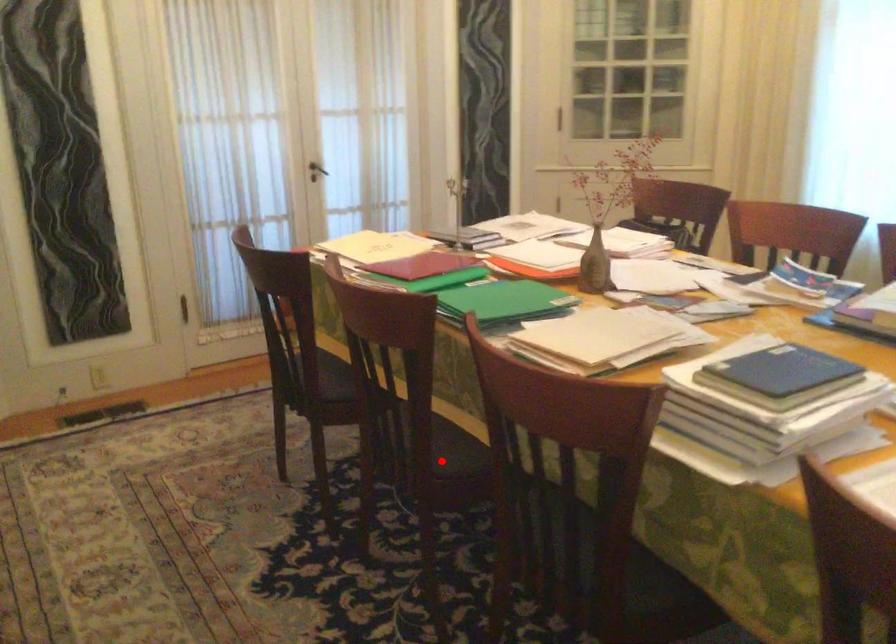
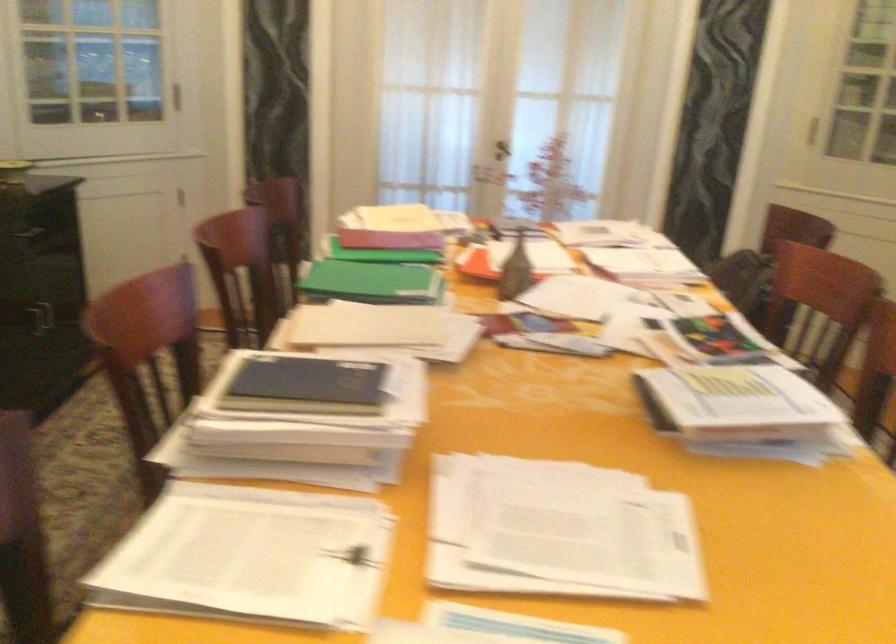
Question: I am providing you with two images of the same scene from different viewpoints. A red point is marked on the first image. Can you still see the location of the red point in image 2?

Choices:
 (A) Yes
 (B) No

Answer: (B)